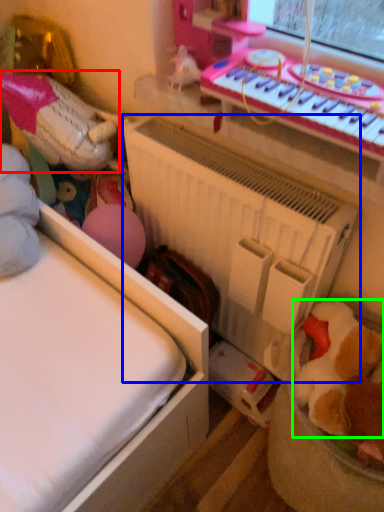
Question: Which object is the farthest from toy (highlighted by a red box)? Choose among these: radiator (highlighted by a blue box) or toy (highlighted by a green box).

Choices:
 (A) radiator
 (B) toy

Answer: (B)